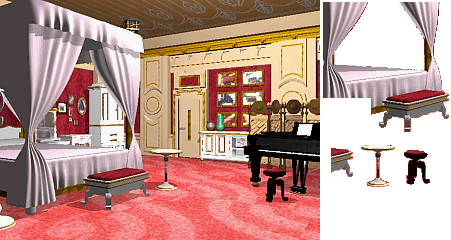
I want to click on piano, so click(x=288, y=153).